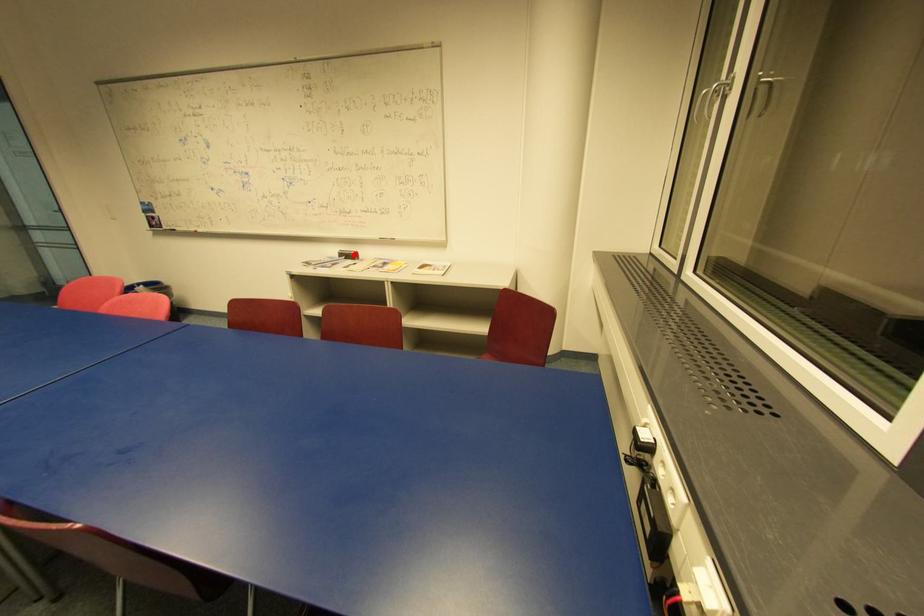
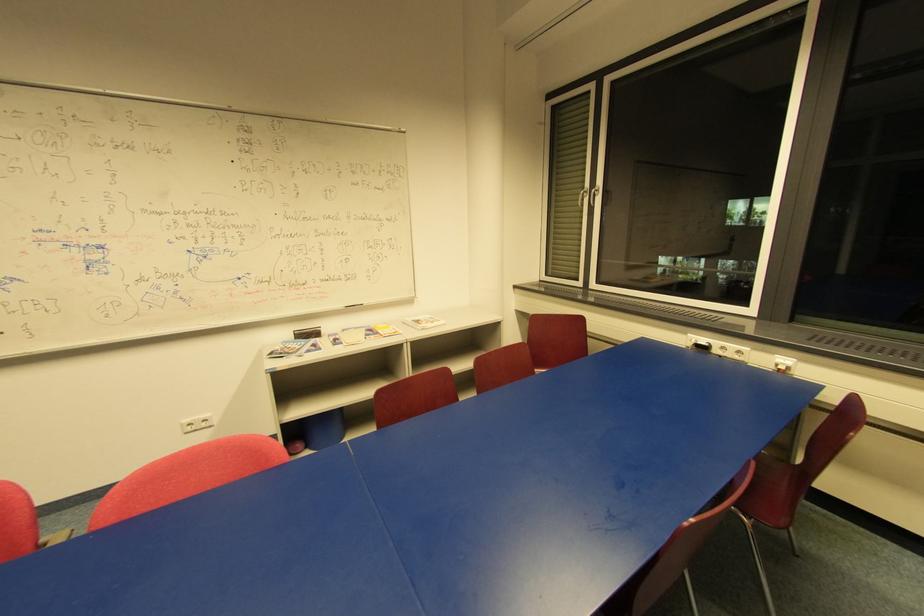
In the second image, find the point that corresponds to the highlighted location in the first image.

(319, 331)